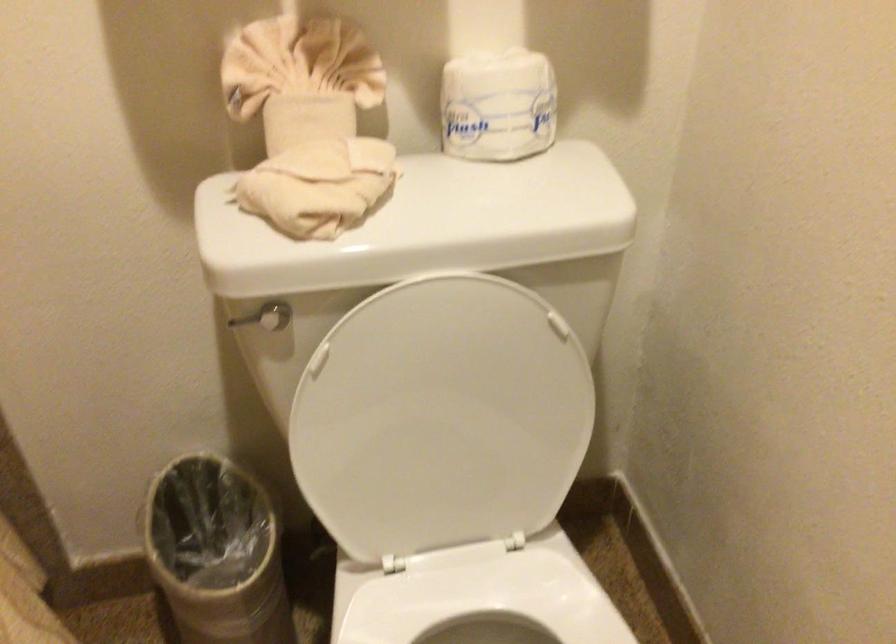
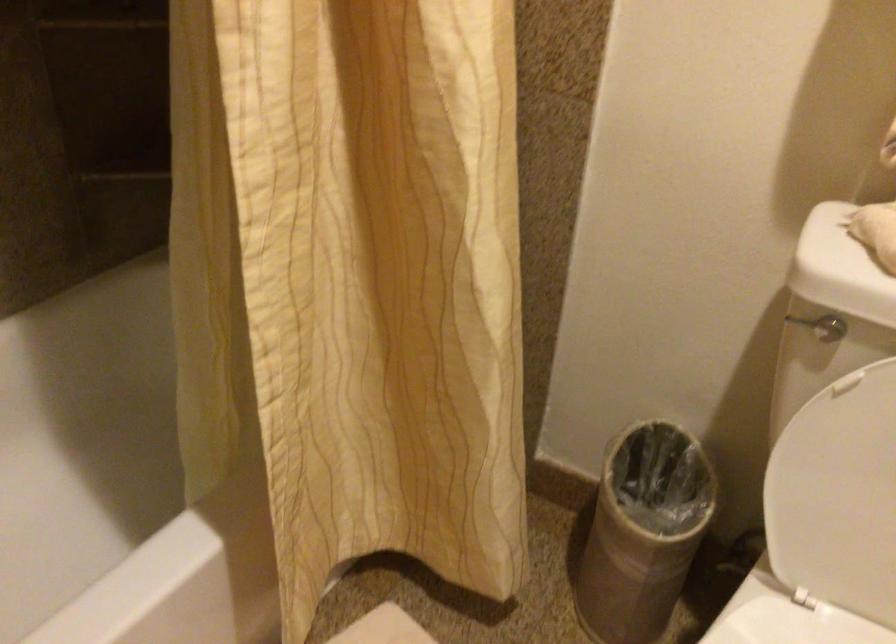
Question: The camera is either moving clockwise (left) or counter-clockwise (right) around the object. The first image is from the beginning of the video and the second image is from the end. Is the camera moving left or right when shooting the video?

Choices:
 (A) Left
 (B) Right

Answer: (B)